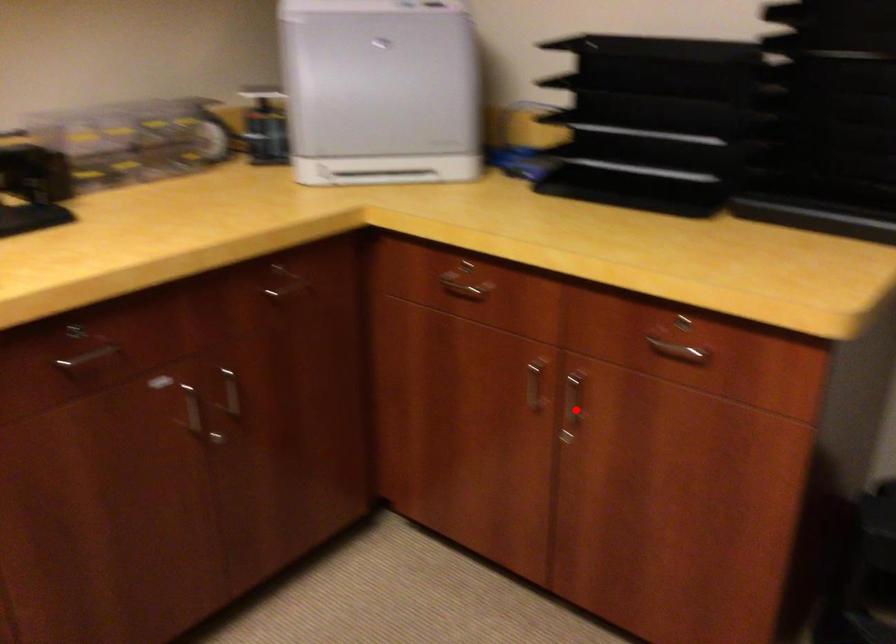
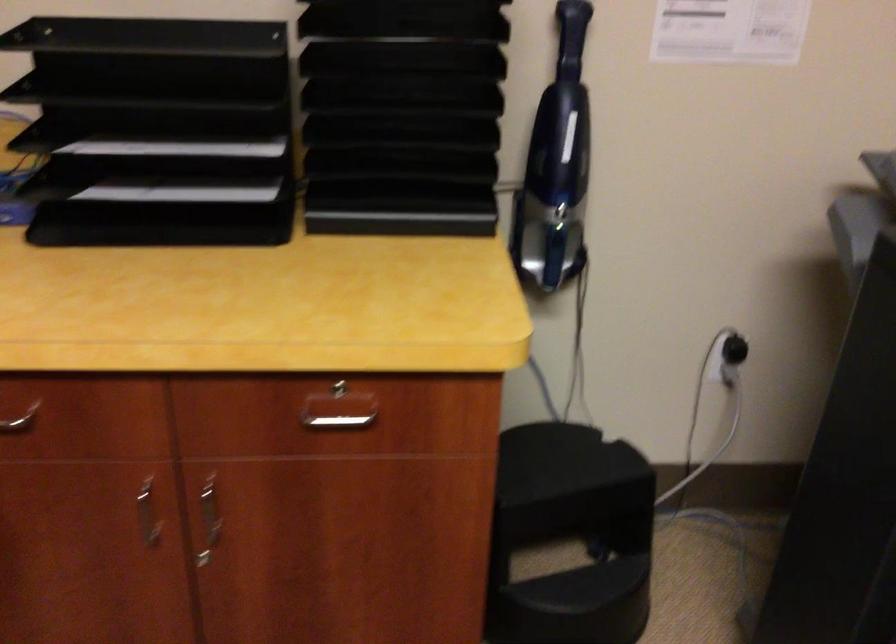
Question: I am providing you with two images of the same scene from different viewpoints. A red point is shown in image1. For the corresponding object point in image2, is it positioned nearer or farther from the camera?

Choices:
 (A) Nearer
 (B) Farther

Answer: (A)